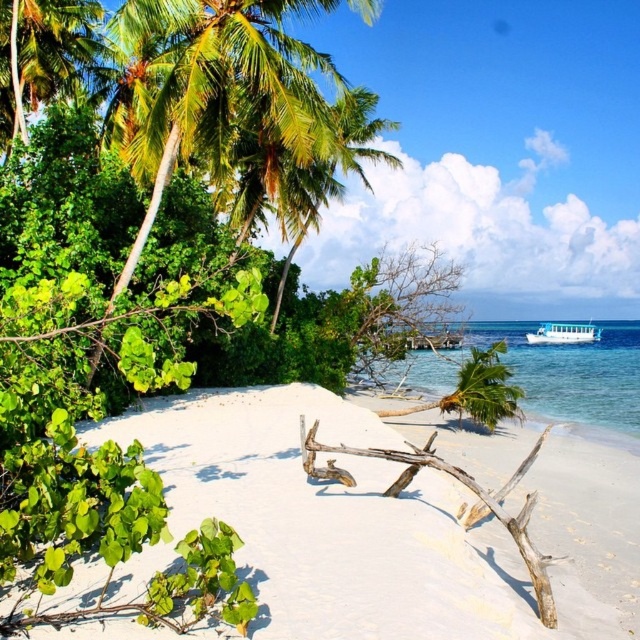
Can you confirm if clear blue water at lower right is smaller than green leafy palm tree at upper left?

No.

Does clear blue water at lower right lie in front of green leafy palm tree at upper left?

Yes, it is in front of green leafy palm tree at upper left.

Does point (541, 394) come farther from viewer compared to point (52, 6)?

Yes, it is.

The image size is (640, 640). Identify the location of clear blue water at lower right. (548, 376).

Is white sandy beach at center bigger than white glossy boat at upper right?

Incorrect, white sandy beach at center is not larger than white glossy boat at upper right.

Is point (371, 621) positioned behind point (568, 330)?

No, (371, 621) is in front of (568, 330).

At what (x,y) coordinates should I click in order to perform the action: click on white sandy beach at center. Please return your answer as a coordinate pair (x, y). Looking at the image, I should click on (394, 518).

Identify the location of white sandy beach at center. The width and height of the screenshot is (640, 640). (394, 518).

Measure the distance between green leafy palm tree at upper left and white glossy boat at upper right.

green leafy palm tree at upper left and white glossy boat at upper right are 59.85 meters apart.

Is green leafy palm tree at upper left positioned at the back of white glossy boat at upper right?

No, green leafy palm tree at upper left is in front of white glossy boat at upper right.

The height and width of the screenshot is (640, 640). I want to click on green leafy palm tree at upper left, so click(x=42, y=54).